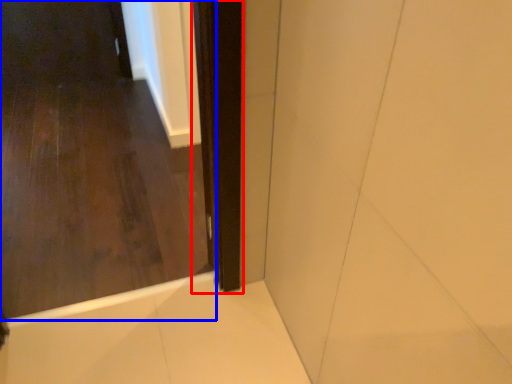
Question: Which object is closer to the camera taking this photo, screen door (highlighted by a red box) or door (highlighted by a blue box)?

Choices:
 (A) screen door
 (B) door

Answer: (B)